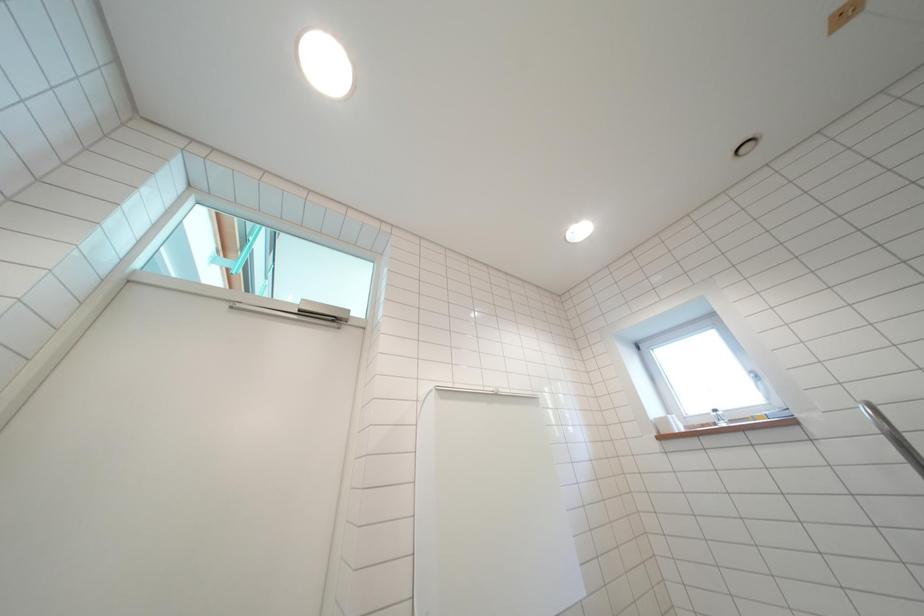
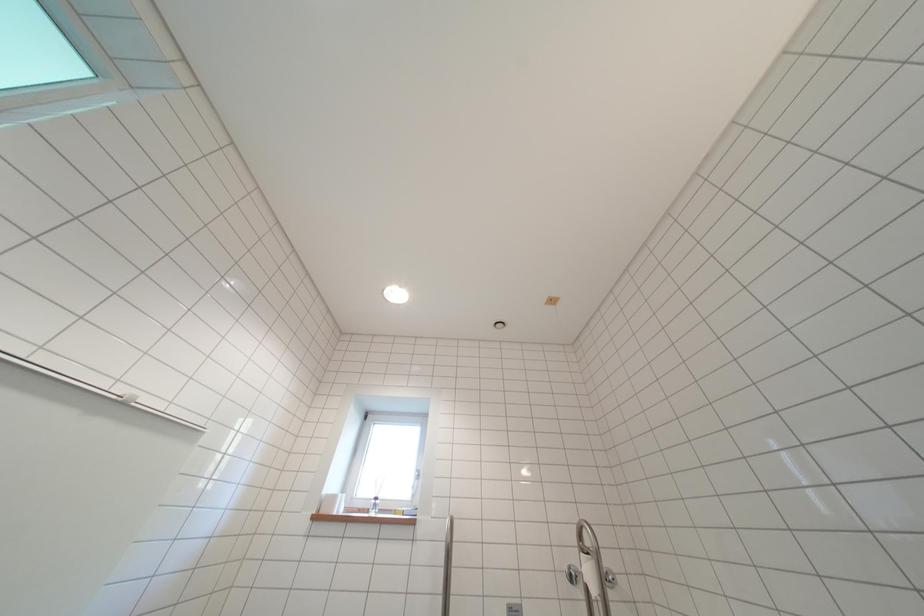
The first image is from the beginning of the video and the second image is from the end. How did the camera likely rotate when shooting the video?

The rotation direction of the camera is right-up.